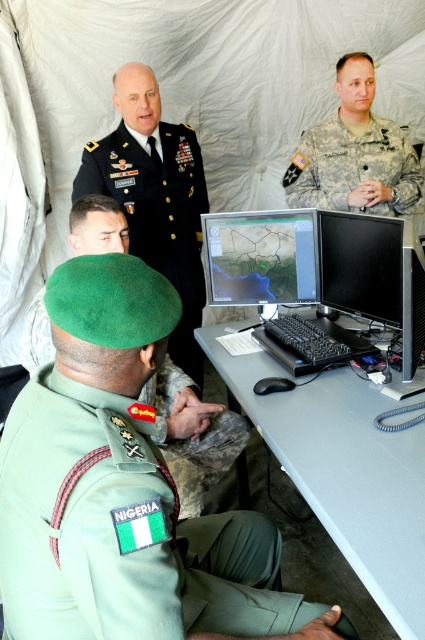
Question: Estimate the real-world distances between objects in this image. Which object is farther from the green felt beret at lower left?

Choices:
 (A) green fabric uniform at center
 (B) gray plastic table at center

Answer: (A)

Question: Does green felt beret at lower left appear on the left side of camouflage fabric uniform at upper center?

Choices:
 (A) yes
 (B) no

Answer: (A)

Question: Observing the image, what is the correct spatial positioning of gray plastic table at center in reference to camouflage fabric uniform at upper center?

Choices:
 (A) right
 (B) left

Answer: (B)

Question: Which object appears farthest from the camera in this image?

Choices:
 (A) camouflage fabric uniform at upper center
 (B) gray plastic table at center
 (C) green fabric uniform at center

Answer: (A)

Question: Which object is the closest to the green felt beret at lower left?

Choices:
 (A) green matte map at center
 (B) black glossy monitor at center

Answer: (A)

Question: Can you confirm if green felt beret at lower left is positioned below green beret at center?

Choices:
 (A) yes
 (B) no

Answer: (B)